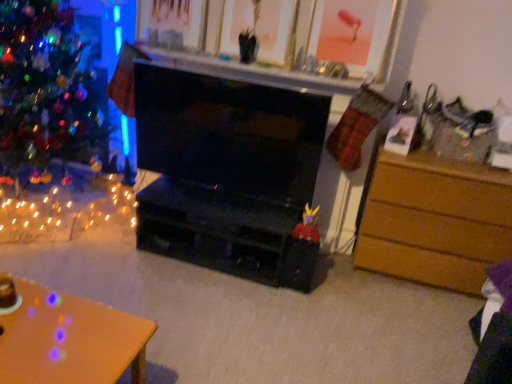
Question: Does brown wooden chest of drawers at right have a greater height compared to black glossy fireplace at center?

Choices:
 (A) yes
 (B) no

Answer: (A)

Question: Is brown wooden chest of drawers at right at the left side of black glossy fireplace at center?

Choices:
 (A) no
 (B) yes

Answer: (A)

Question: Does brown wooden chest of drawers at right have a smaller size compared to black glossy fireplace at center?

Choices:
 (A) yes
 (B) no

Answer: (B)

Question: Is black glossy fireplace at center at the back of brown wooden chest of drawers at right?

Choices:
 (A) no
 (B) yes

Answer: (A)

Question: Is brown wooden chest of drawers at right shorter than black glossy fireplace at center?

Choices:
 (A) yes
 (B) no

Answer: (B)

Question: Is brown wooden chest of drawers at right aimed at black glossy fireplace at center?

Choices:
 (A) yes
 (B) no

Answer: (B)

Question: Does brown wooden chest of drawers at right turn towards shiny multicolored ornaments at left?

Choices:
 (A) yes
 (B) no

Answer: (B)

Question: Is shiny multicolored ornaments at left at the back of brown wooden chest of drawers at right?

Choices:
 (A) no
 (B) yes

Answer: (A)

Question: Is brown wooden chest of drawers at right not within shiny multicolored ornaments at left?

Choices:
 (A) yes
 (B) no

Answer: (A)

Question: Is brown wooden chest of drawers at right to the left of shiny multicolored ornaments at left from the viewer's perspective?

Choices:
 (A) no
 (B) yes

Answer: (A)

Question: Is brown wooden chest of drawers at right at the right side of shiny multicolored ornaments at left?

Choices:
 (A) no
 (B) yes

Answer: (B)

Question: Can you confirm if brown wooden chest of drawers at right is bigger than shiny multicolored ornaments at left?

Choices:
 (A) yes
 (B) no

Answer: (B)

Question: From a real-world perspective, is shiny multicolored ornaments at left located beneath orange wood desk at lower left?

Choices:
 (A) yes
 (B) no

Answer: (B)